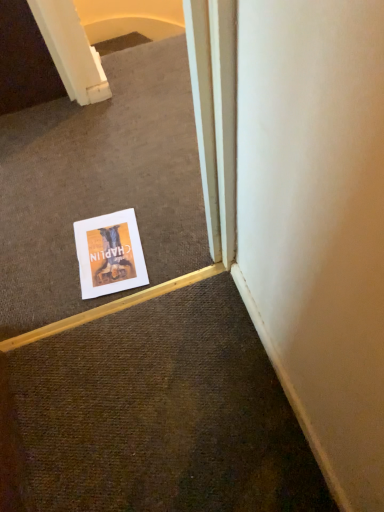
This screenshot has width=384, height=512. What are the coordinates of `vacant region to the right of white paper poster at center` in the screenshot? It's located at (168, 234).